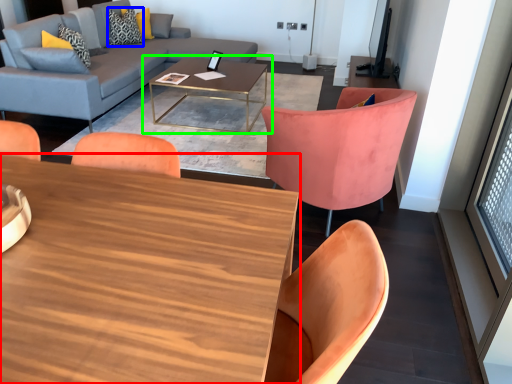
Question: Which object is positioned farthest from coffee table (highlighted by a red box)? Select from pillow (highlighted by a blue box) and coffee table (highlighted by a green box).

Choices:
 (A) pillow
 (B) coffee table

Answer: (A)